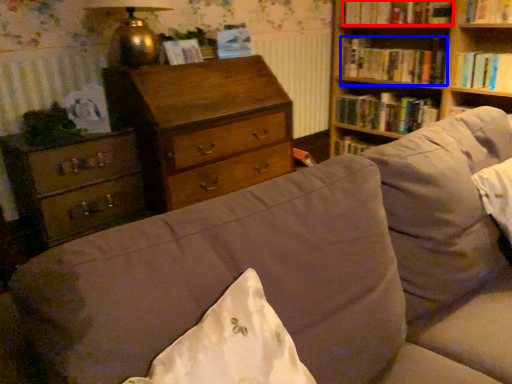
Question: Which object appears closest to the camera in this image, book (highlighted by a red box) or book (highlighted by a blue box)?

Choices:
 (A) book
 (B) book

Answer: (A)